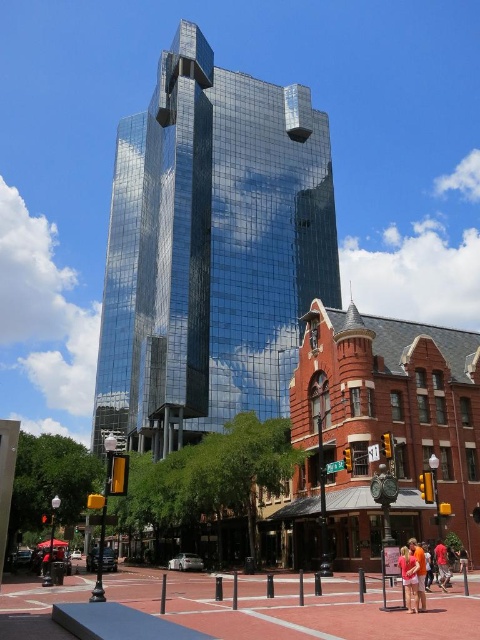
Does point (415, 561) lie in front of point (444, 582)?

Yes, it is in front of point (444, 582).

Can you confirm if pink fabric dress at center is positioned below red cotton shirt at lower right?

Actually, pink fabric dress at center is above red cotton shirt at lower right.

Image resolution: width=480 pixels, height=640 pixels. What do you see at coordinates (408, 579) in the screenshot?
I see `pink fabric dress at center` at bounding box center [408, 579].

The width and height of the screenshot is (480, 640). What are the coordinates of `pink fabric dress at center` in the screenshot? It's located at (408, 579).

Is pink fabric dress at center taller than orange cotton shirt at lower center?

No, pink fabric dress at center is not taller than orange cotton shirt at lower center.

Looking at this image, who is higher up, pink fabric dress at center or orange cotton shirt at lower center?

pink fabric dress at center

Identify the location of pink fabric dress at center. This screenshot has width=480, height=640. (408, 579).

Where is `pink fabric dress at center`? pink fabric dress at center is located at coordinates (408, 579).

Can you confirm if orange cotton shirt at lower center is positioned above red cotton shirt at lower right?

Indeed, orange cotton shirt at lower center is positioned over red cotton shirt at lower right.

Does point (420, 548) come behind point (441, 579)?

No, it is in front of (441, 579).

Who is more forward, (417, 552) or (443, 557)?

Point (417, 552) is in front.

Locate an element on the screen. This screenshot has width=480, height=640. orange cotton shirt at lower center is located at coordinates (419, 570).